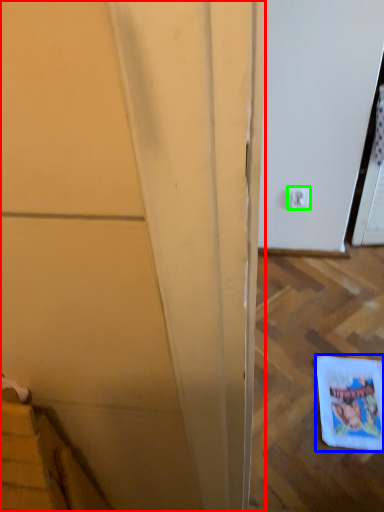
Question: Which object is positioned closest to door (highlighted by a red box)? Select from comic book (highlighted by a blue box) and electric outlet (highlighted by a green box).

Choices:
 (A) comic book
 (B) electric outlet

Answer: (A)